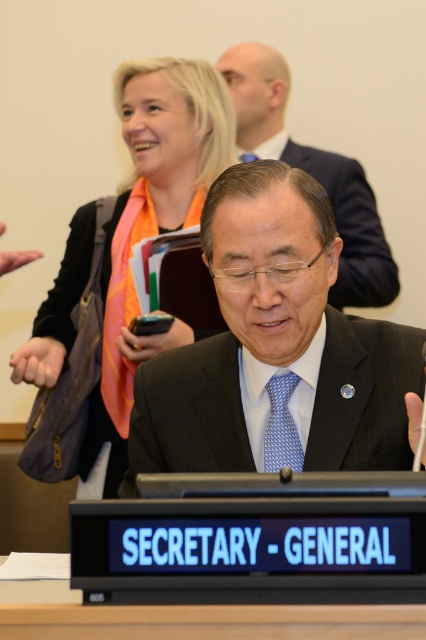
Is wooden table at center closer to the viewer compared to black suit at center?

Yes.

Which of these two, wooden table at center or black suit at center, stands taller?

black suit at center

Does point (19, 586) come farther from viewer compared to point (250, 152)?

That is False.

Locate an element on the screen. The height and width of the screenshot is (640, 426). wooden table at center is located at coordinates (193, 618).

Who is higher up, black matte suit at center or orange scarf at upper left?

Positioned higher is orange scarf at upper left.

Does black matte suit at center appear under orange scarf at upper left?

Indeed, black matte suit at center is positioned under orange scarf at upper left.

Is point (279, 180) closer to camera compared to point (126, 376)?

Yes, it is in front of point (126, 376).

At what (x,y) coordinates should I click in order to perform the action: click on black matte suit at center. Please return your answer as a coordinate pair (x, y). Looking at the image, I should click on (276, 349).

Between orange scarf at upper left and black suit at center, which one is positioned lower?

Positioned lower is orange scarf at upper left.

Between orange scarf at upper left and black suit at center, which one is positioned higher?

black suit at center is higher up.

Find the location of a particular element. The width and height of the screenshot is (426, 640). orange scarf at upper left is located at coordinates (152, 220).